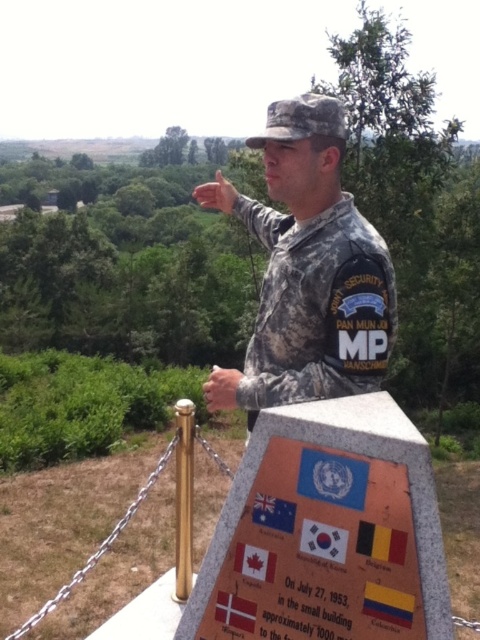
Question: Which is farther from the yellowmaterial/textureflag at right?

Choices:
 (A) camouflage uniform at center
 (B) white fabric flag at center

Answer: (A)

Question: Is camouflage uniform at center to the left of yellowmaterial/textureflag at right from the viewer's perspective?

Choices:
 (A) no
 (B) yes

Answer: (B)

Question: Does yellowmaterial/textureflag at right have a lesser width compared to white fabric flag at center?

Choices:
 (A) no
 (B) yes

Answer: (B)

Question: Which object is positioned farthest from the white fabric flag at center?

Choices:
 (A) yellowmaterial/textureflag at right
 (B) camouflage uniform at center

Answer: (B)

Question: Which is farther from the white fabric flag at center?

Choices:
 (A) camouflage uniform at center
 (B) yellowmaterial/textureflag at right

Answer: (A)

Question: Does camouflage uniform at center appear under white fabric flag at center?

Choices:
 (A) yes
 (B) no

Answer: (B)